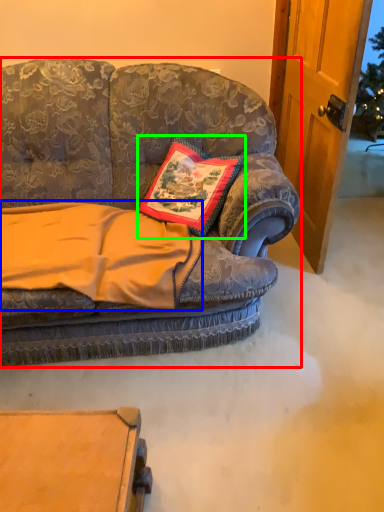
Question: Estimate the real-world distances between objects in this image. Which object is farther from studio couch (highlighted by a red box), blanket (highlighted by a blue box) or pillow (highlighted by a green box)?

Choices:
 (A) blanket
 (B) pillow

Answer: (B)